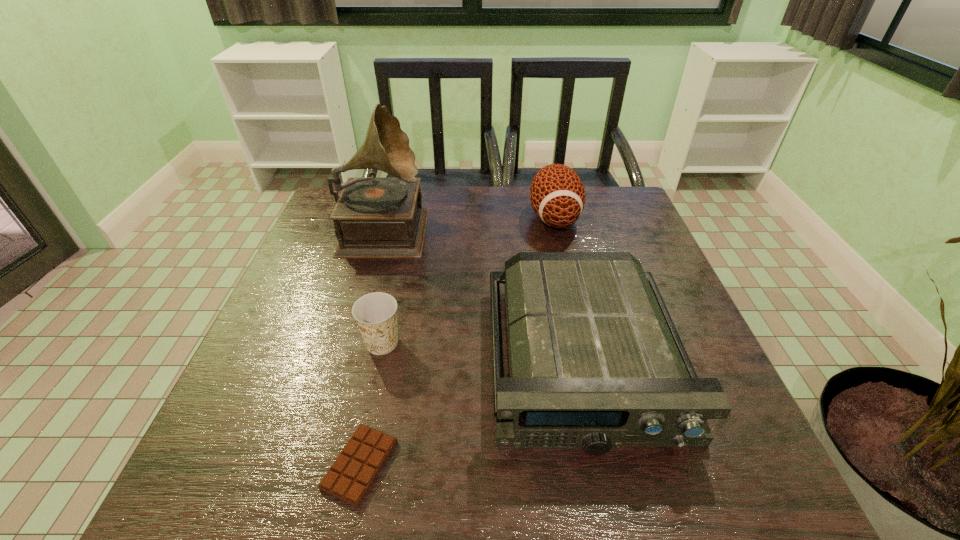
The height and width of the screenshot is (540, 960). Find the location of `record player at the far edge`. record player at the far edge is located at coordinates (374, 217).

The width and height of the screenshot is (960, 540). I want to click on football that is at the far edge, so click(557, 195).

At what (x,y) coordinates should I click in order to perform the action: click on radio receiver present at the near edge. Please return your answer as a coordinate pair (x, y). Image resolution: width=960 pixels, height=540 pixels. Looking at the image, I should click on (596, 363).

You are a GUI agent. You are given a task and a screenshot of the screen. Output one action in this format:
    pyautogui.click(x=<x>, y=<y>)
    Task: Click on the candy bar situated at the near edge
    
    Given the screenshot: What is the action you would take?
    pyautogui.click(x=350, y=477)

This screenshot has width=960, height=540. Identify the location of object that is positioned at the left edge. (374, 217).

The height and width of the screenshot is (540, 960). In order to click on object present at the right edge in this screenshot , I will do `click(596, 363)`.

Find the location of a particular element. object situated at the far left corner is located at coordinates (374, 217).

I want to click on object that is at the near right corner, so click(x=596, y=363).

At what (x,y) coordinates should I click in order to perform the action: click on vacant space at the far edge of the desktop. Please return your answer as a coordinate pair (x, y). This screenshot has height=540, width=960. Looking at the image, I should click on (430, 209).

In the image, there is a desktop. Where is `vacant space at the left edge`? vacant space at the left edge is located at coordinates (283, 426).